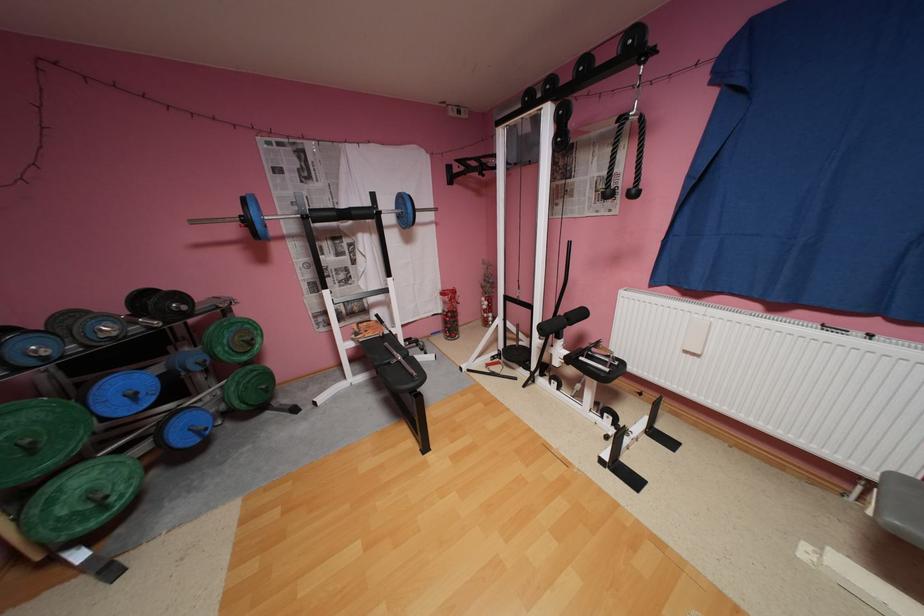
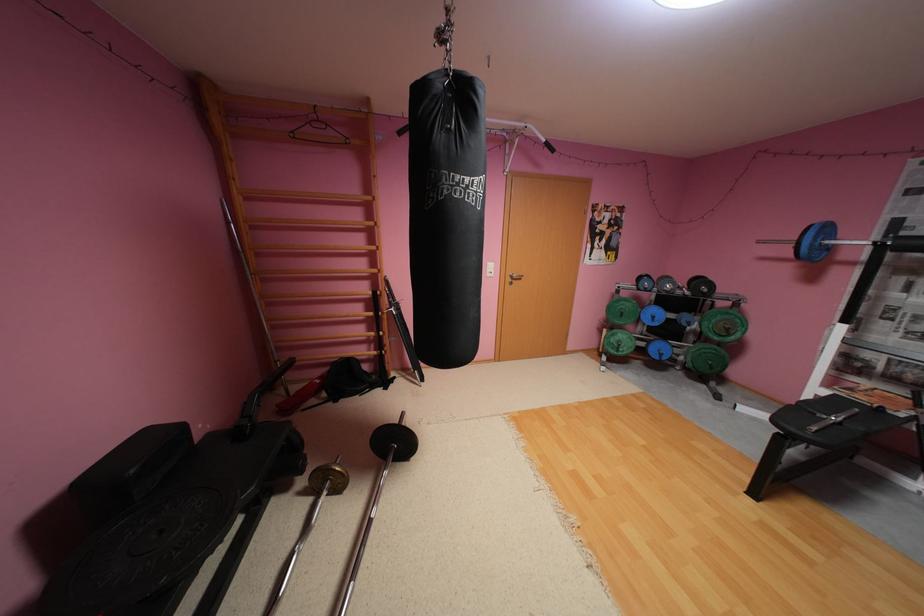
Locate, in the second image, the point that corresponds to point (193, 308) in the first image.

(714, 291)